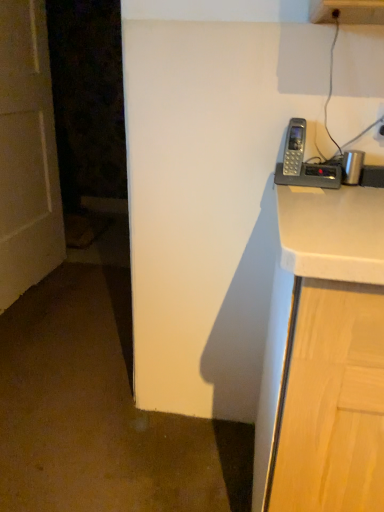
Locate an element on the screen. The image size is (384, 512). white matte door at left is located at coordinates (27, 153).

Find the location of a particular element. The width and height of the screenshot is (384, 512). white plastic electric outlet at upper right is located at coordinates (380, 123).

What is the approximate width of gray plastic phone at upper right?

The width of gray plastic phone at upper right is 4.20 inches.

I want to click on white matte door at left, so click(x=27, y=153).

Is white matte door at left located outside white plastic electric outlet at upper right?

Indeed, white matte door at left is completely outside white plastic electric outlet at upper right.

From the image's perspective, would you say white matte door at left is shown under white plastic electric outlet at upper right?

Incorrect, from the image's perspective, white matte door at left is higher than white plastic electric outlet at upper right.

How distant is white matte door at left from white plastic electric outlet at upper right?

A distance of 1.91 meters exists between white matte door at left and white plastic electric outlet at upper right.

From a real-world perspective, is white matte door at left physically located above or below white plastic electric outlet at upper right?

In terms of real-world spatial position, white matte door at left is below white plastic electric outlet at upper right.

Would you say white plastic electric outlet at upper right is a long distance from white matte door at left?

Absolutely, white plastic electric outlet at upper right is distant from white matte door at left.

Considering the positions of points (381, 128) and (49, 117), is point (381, 128) closer to camera compared to point (49, 117)?

Yes, point (381, 128) is closer to viewer.

How much distance is there between white plastic electric outlet at upper right and white matte door at left?

The distance of white plastic electric outlet at upper right from white matte door at left is 6.26 feet.

Based on their positions, is white plastic electric outlet at upper right located to the left or right of white matte door at left?

white plastic electric outlet at upper right is positioned on white matte door at left's right side.

Considering the positions of objects white plastic electric outlet at upper right and gray plastic phone at upper right in the image provided, who is more to the right, white plastic electric outlet at upper right or gray plastic phone at upper right?

From the viewer's perspective, white plastic electric outlet at upper right appears more on the right side.

Which object is further away from the camera, white plastic electric outlet at upper right or gray plastic phone at upper right?

white plastic electric outlet at upper right is more distant.

From a real-world perspective, is white plastic electric outlet at upper right beneath gray plastic phone at upper right?

Actually, white plastic electric outlet at upper right is physically above gray plastic phone at upper right in the real world.

I want to click on door above the gray plastic phone at upper right (from the image's perspective), so click(27, 153).

Based on the photo, which object is thinner, white matte door at left or gray plastic phone at upper right?

With smaller width is white matte door at left.

From a real-world perspective, which object rests below the other?

white matte door at left, from a real-world perspective.

Does white matte door at left have a lesser height compared to gray plastic phone at upper right?

No, white matte door at left is not shorter than gray plastic phone at upper right.

In the scene shown: Is gray plastic phone at upper right far away from white plastic electric outlet at upper right?

That's not correct — gray plastic phone at upper right is a little close to white plastic electric outlet at upper right.

Looking at the image, does gray plastic phone at upper right seem bigger or smaller compared to white plastic electric outlet at upper right?

Considering their sizes, gray plastic phone at upper right takes up more space than white plastic electric outlet at upper right.

Looking at this image, what's the angular difference between gray plastic phone at upper right and white plastic electric outlet at upper right's facing directions?

1.85 degrees separate the facing orientations of gray plastic phone at upper right and white plastic electric outlet at upper right.

Considering the sizes of gray plastic phone at upper right and white plastic electric outlet at upper right in the image, is gray plastic phone at upper right wider or thinner than white plastic electric outlet at upper right?

A: In the image, gray plastic phone at upper right appears to be wider than white plastic electric outlet at upper right.

Can you confirm if gray plastic phone at upper right is positioned to the right of white matte door at left?

Yes, gray plastic phone at upper right is to the right of white matte door at left.

Is gray plastic phone at upper right positioned behind white matte door at left?

No, gray plastic phone at upper right is in front of white matte door at left.

In the scene shown: Does gray plastic phone at upper right touch white matte door at left?

gray plastic phone at upper right is not next to white matte door at left, and they're not touching.

Considering the relative sizes of gray plastic phone at upper right and white matte door at left in the image provided, is gray plastic phone at upper right wider than white matte door at left?

Yes.

You are a GUI agent. You are given a task and a screenshot of the screen. Output one action in this format:
    pyautogui.click(x=<x>, y=<y>)
    Task: Click on the door above the white plastic electric outlet at upper right (from the image's perspective)
    This screenshot has height=512, width=384.
    Given the screenshot: What is the action you would take?
    pyautogui.click(x=27, y=153)

At what (x,y) coordinates should I click in order to perform the action: click on door behind the white plastic electric outlet at upper right. Please return your answer as a coordinate pair (x, y). The image size is (384, 512). Looking at the image, I should click on pyautogui.click(x=27, y=153).

Which object lies nearer to the anchor point white matte door at left, gray plastic phone at upper right or white plastic electric outlet at upper right?

Based on the image, gray plastic phone at upper right appears to be nearer to white matte door at left.

Which object lies further to the anchor point white plastic electric outlet at upper right, gray plastic phone at upper right or white matte door at left?

Based on the image, white matte door at left appears to be further to white plastic electric outlet at upper right.

Considering their positions, is white plastic electric outlet at upper right positioned closer to white matte door at left than gray plastic phone at upper right?

Among the two, gray plastic phone at upper right is located nearer to white matte door at left.

Based on their spatial positions, is white plastic electric outlet at upper right or white matte door at left closer to gray plastic phone at upper right?

white plastic electric outlet at upper right is positioned closer to the anchor gray plastic phone at upper right.

Estimate the real-world distances between objects in this image. Which object is closer to gray plastic phone at upper right, white matte door at left or white plastic electric outlet at upper right?

Based on the image, white plastic electric outlet at upper right appears to be nearer to gray plastic phone at upper right.

Which object lies nearer to the anchor point white plastic electric outlet at upper right, white matte door at left or gray plastic phone at upper right?

gray plastic phone at upper right is closer to white plastic electric outlet at upper right.

Where is `corded phone between white matte door at left and white plastic electric outlet at upper right in the horizontal direction`? This screenshot has height=512, width=384. corded phone between white matte door at left and white plastic electric outlet at upper right in the horizontal direction is located at coordinates point(303,163).